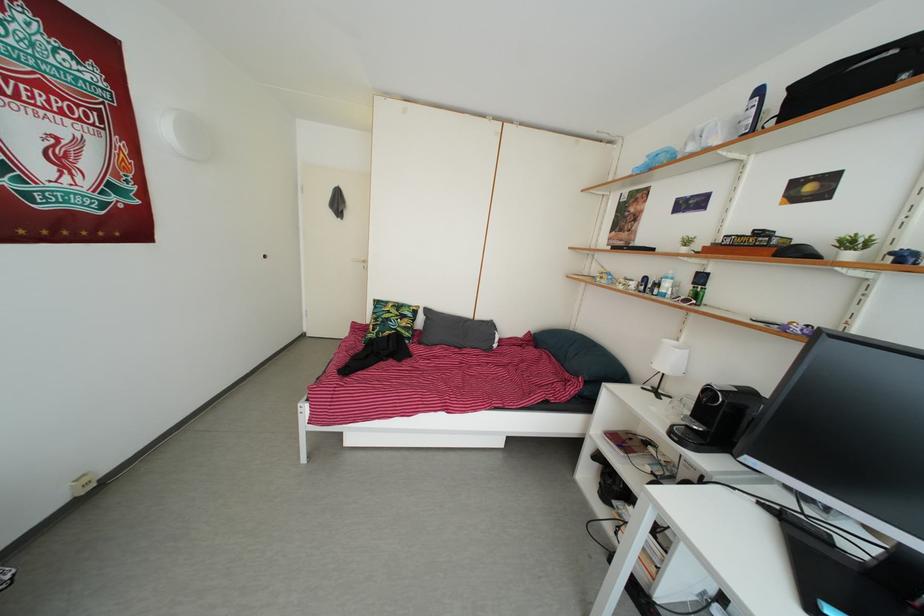
Locate an element on the screen. Image resolution: width=924 pixels, height=616 pixels. dark blue pillow is located at coordinates (581, 359).